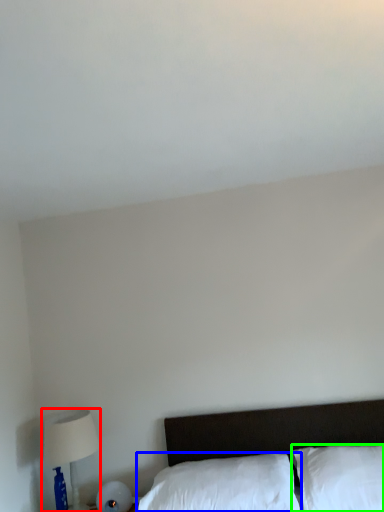
Question: Which object is positioned farthest from table lamp (highlighted by a red box)? Select from pillow (highlighted by a blue box) and pillow (highlighted by a green box).

Choices:
 (A) pillow
 (B) pillow

Answer: (B)